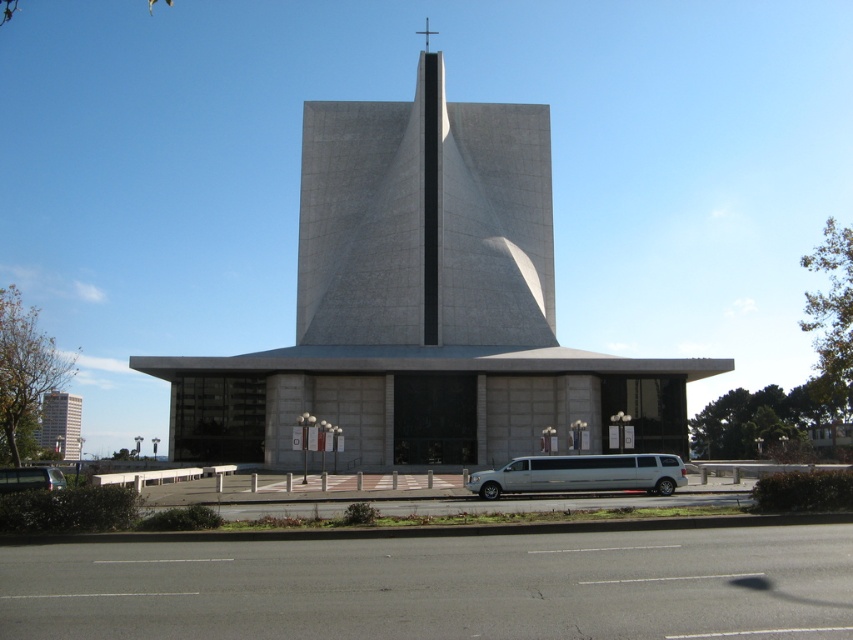
You are standing in front of the modern church structure. You notice two points marked on the tower. The first point is at coordinate point (78, 428) and the second is at point (9, 488). Which point is closer to you?

Point (78, 428) is further to the camera than point (9, 488), so the point closer to you is point (9, 488).

You are standing at the entrance of the modern church facing the tower. You notice two points marked on the tower. The first point is at coordinates point (537, 308) and the second is at point (67, 420). Which point is closer to you?

Point (537, 308) is in front of point (67, 420), so the first point is closer to you.

You are a photographer planning to capture the smooth concrete church at center and the silver metallic limousine at lower center in a single shot. Based on their positions, which object should you position closer to the left side of your camera frame?

The smooth concrete church at center is to the left of the silver metallic limousine at lower center, so you should position the smooth concrete church at center closer to the left side of your camera frame.